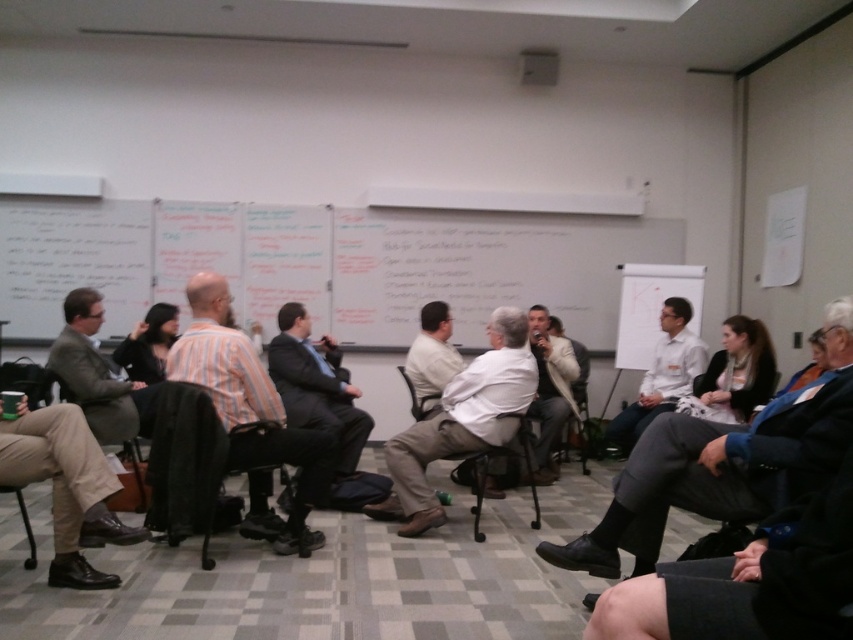
Who is more forward, (549, 429) or (582, 353)?

Positioned in front is point (549, 429).

Which is behind, point (547, 426) or point (583, 348)?

Positioned behind is point (583, 348).

Does point (531, 321) come closer to viewer compared to point (582, 444)?

Yes, it is.

Where is `white matte shirt at center`? The image size is (853, 640). white matte shirt at center is located at coordinates (549, 388).

Can you confirm if matte gray suit at left is positioned above black plastic chair at lower left?

Indeed, matte gray suit at left is positioned over black plastic chair at lower left.

Is matte gray suit at left to the right of black plastic chair at lower left from the viewer's perspective?

In fact, matte gray suit at left is to the left of black plastic chair at lower left.

At what (x,y) coordinates should I click in order to perform the action: click on matte gray suit at left. Please return your answer as a coordinate pair (x, y). Image resolution: width=853 pixels, height=640 pixels. Looking at the image, I should click on [97, 374].

Locate an element on the screen. The height and width of the screenshot is (640, 853). matte gray suit at left is located at coordinates (97, 374).

Is point (445, 326) closer to camera compared to point (28, 556)?

No, it is behind (28, 556).

The image size is (853, 640). Identify the location of light beige shirt at center. (432, 355).

This screenshot has width=853, height=640. I want to click on light beige shirt at center, so click(432, 355).